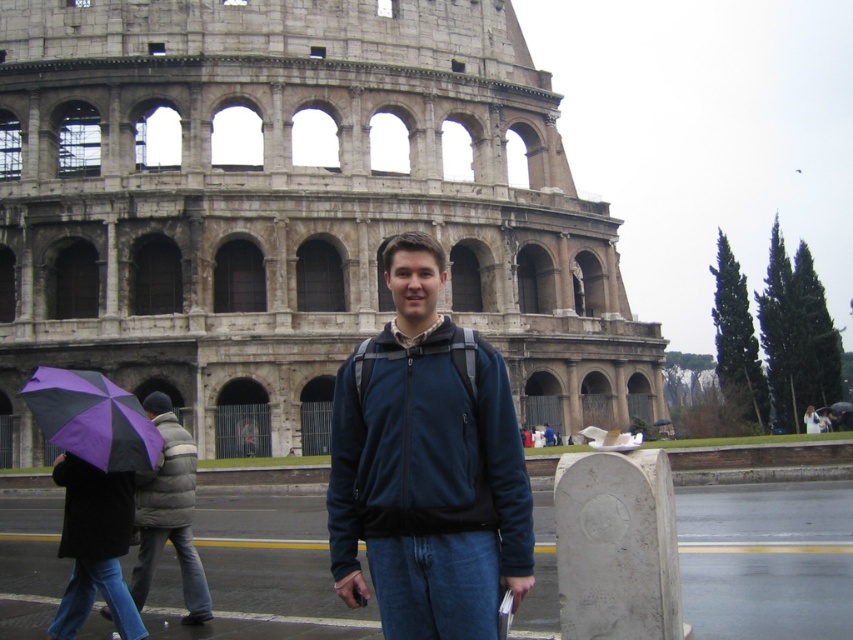
Looking at this image, you are a tourist at the Colosseum and see both the gray down jacket at left and the gray puffy jacket at left. Which one is positioned more to the left side?

The gray down jacket at left is positioned more to the left than the gray puffy jacket at left.

You are a tourist standing at the Colosseum. You see the stone amphitheater at center and the dark blue fleece jacket at center. If you want to take a photo of both objects in the same frame, will you need to zoom in or zoom out your camera?

The stone amphitheater at center and dark blue fleece jacket at center are 19.37 meters apart from each other. To capture both in the same frame, you would need to zoom out to widen the field of view so that both objects fit within the camera frame.

You are a photographer planning to take a picture of the Colosseum with the gray down jacket at left in the scene. Based on the jacket position, where should you position the camera to ensure both the Colosseum and the jacket are in the frame?

The gray down jacket at left is located at point (167, 513) in the image. To include both the Colosseum in the background and the jacket in the foreground, position the camera so that the jacket is placed slightly to the left side of the frame, near the lower left quadrant, while ensuring the Colosseum fills the background. This composition will balance the foreground subject with the iconic backdrop.